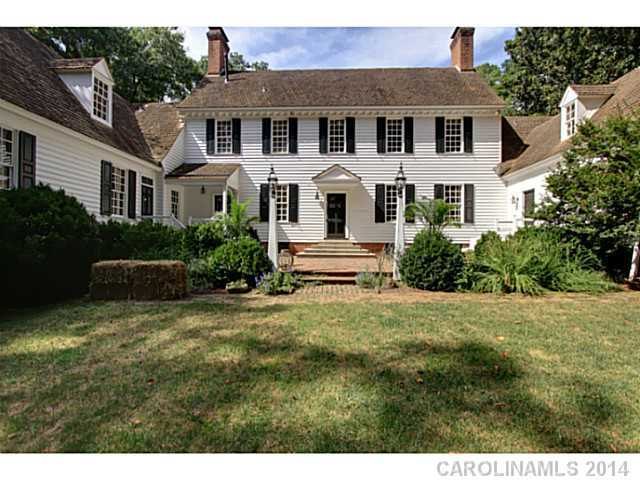
This screenshot has width=640, height=480. I want to click on garage, so click(x=89, y=190).